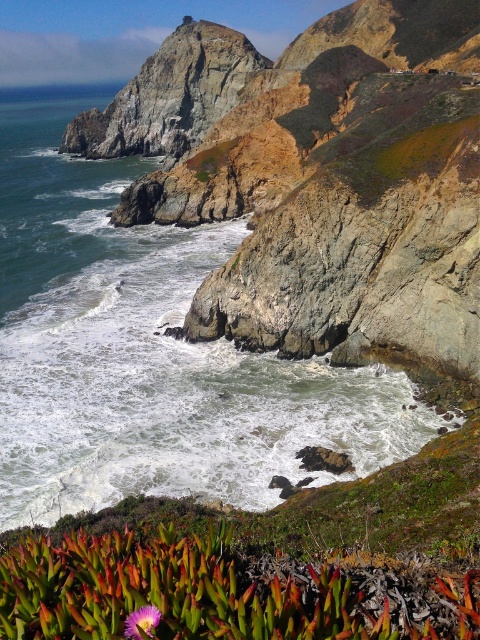
Which of these two, foamy white water at center or purple matte flower at lower center, stands taller?

With more height is foamy white water at center.

Does foamy white water at center have a lesser width compared to purple matte flower at lower center?

In fact, foamy white water at center might be wider than purple matte flower at lower center.

Image resolution: width=480 pixels, height=640 pixels. What do you see at coordinates (146, 353) in the screenshot?
I see `foamy white water at center` at bounding box center [146, 353].

You are a GUI agent. You are given a task and a screenshot of the screen. Output one action in this format:
    pyautogui.click(x=<x>, y=<y>)
    Task: Click on the foamy white water at center
    The image size is (480, 640).
    Given the screenshot: What is the action you would take?
    pyautogui.click(x=146, y=353)